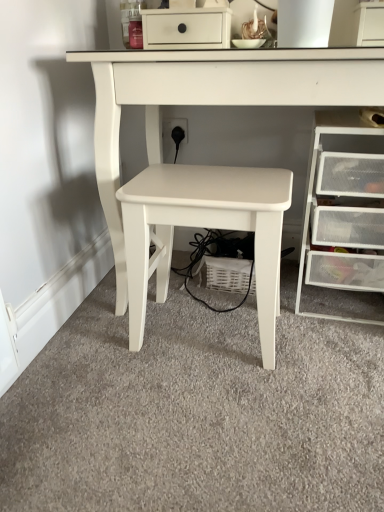
Where is `white matte table at center, the 1th table when ordered from right to left`? The height and width of the screenshot is (512, 384). white matte table at center, the 1th table when ordered from right to left is located at coordinates (208, 166).

Identify the location of white matte table at center, arranged as the 1th table when viewed from the left. (204, 227).

Locate an element on the screen. white matte table at center, the 1th table when ordered from right to left is located at coordinates (208, 166).

Can you see white matte table at center, arranged as the 1th table when viewed from the left, touching clear plastic drawers at right?

white matte table at center, arranged as the 1th table when viewed from the left, is not next to clear plastic drawers at right, and they're not touching.

Is white matte table at center, positioned as the second table in right-to-left order, further to camera compared to clear plastic drawers at right?

No, it is not.

I want to click on table that appears below the clear plastic drawers at right (from the image's perspective), so click(204, 227).

Consider the image. From the image's perspective, would you say clear plastic drawers at right is positioned over white matte table at center, arranged as the 1th table when viewed from the left?

Yes, from the image's perspective, clear plastic drawers at right is over white matte table at center, arranged as the 1th table when viewed from the left.

Where is `table located below the clear plastic drawers at right (from the image's perspective)`? The width and height of the screenshot is (384, 512). table located below the clear plastic drawers at right (from the image's perspective) is located at coordinates (204, 227).

From a real-world perspective, who is located lower, white matte table at center, positioned as the second table in right-to-left order, or white matte table at center, the 2th table positioned from the left?

white matte table at center, positioned as the second table in right-to-left order, is physically lower.

Considering the relative sizes of white matte table at center, positioned as the second table in right-to-left order, and white matte table at center, the 2th table positioned from the left, in the image provided, is white matte table at center, positioned as the second table in right-to-left order, taller than white matte table at center, the 2th table positioned from the left,?

In fact, white matte table at center, positioned as the second table in right-to-left order, may be shorter than white matte table at center, the 2th table positioned from the left.

Is white matte table at center, arranged as the 1th table when viewed from the left, inside or outside of white matte table at center, the 2th table positioned from the left?

white matte table at center, arranged as the 1th table when viewed from the left, exists entirely within white matte table at center, the 2th table positioned from the left.

From the image's perspective, is white matte table at center, positioned as the second table in right-to-left order, above or below white matte table at center, the 2th table positioned from the left?

→ white matte table at center, positioned as the second table in right-to-left order, is situated lower than white matte table at center, the 2th table positioned from the left, in the image.

Which of these two, white matte table at center, the 1th table when ordered from right to left, or white matte table at center, arranged as the 1th table when viewed from the left, is bigger?

white matte table at center, the 1th table when ordered from right to left, is bigger.

Considering the points (267, 332) and (139, 315), which point is behind, point (267, 332) or point (139, 315)?

Point (139, 315)

Is white matte table at center, the 2th table positioned from the left, in front of white matte table at center, arranged as the 1th table when viewed from the left?

Yes, white matte table at center, the 2th table positioned from the left, is closer to the camera.

Can you confirm if white matte table at center, the 1th table when ordered from right to left, is taller than clear plastic drawers at right?

Indeed, white matte table at center, the 1th table when ordered from right to left, has a greater height compared to clear plastic drawers at right.

Which object is closer to the camera, white matte table at center, the 1th table when ordered from right to left, or clear plastic drawers at right?

white matte table at center, the 1th table when ordered from right to left, is more forward.

In the scene shown: Looking at their sizes, would you say white matte table at center, the 1th table when ordered from right to left, is wider or thinner than clear plastic drawers at right?

white matte table at center, the 1th table when ordered from right to left, is wider than clear plastic drawers at right.

From the image's perspective, is clear plastic drawers at right located beneath white matte table at center, the 1th table when ordered from right to left?

Indeed, from the image's perspective, clear plastic drawers at right is shown beneath white matte table at center, the 1th table when ordered from right to left.

Considering the sizes of objects clear plastic drawers at right and white matte table at center, the 1th table when ordered from right to left, in the image provided, who is taller, clear plastic drawers at right or white matte table at center, the 1th table when ordered from right to left,?

white matte table at center, the 1th table when ordered from right to left.

Which of these two, clear plastic drawers at right or white matte table at center, the 1th table when ordered from right to left, is bigger?

white matte table at center, the 1th table when ordered from right to left, is bigger.

Does clear plastic drawers at right appear on the left side of white matte table at center, the 1th table when ordered from right to left?

No, clear plastic drawers at right is not to the left of white matte table at center, the 1th table when ordered from right to left.

Where is `chest of drawers behind the white matte table at center, arranged as the 1th table when viewed from the left`? This screenshot has height=512, width=384. chest of drawers behind the white matte table at center, arranged as the 1th table when viewed from the left is located at coordinates (344, 211).

At what (x,y) coordinates should I click in order to perform the action: click on the 2nd table counting from the left of the clear plastic drawers at right. Please return your answer as a coordinate pair (x, y). This screenshot has width=384, height=512. Looking at the image, I should click on (204, 227).

Considering their positions, is white matte table at center, the 2th table positioned from the left, positioned closer to clear plastic drawers at right than white matte table at center, positioned as the second table in right-to-left order?

Based on the image, white matte table at center, positioned as the second table in right-to-left order, appears to be nearer to clear plastic drawers at right.

From the image, which object appears to be nearer to clear plastic drawers at right, white matte table at center, arranged as the 1th table when viewed from the left, or white matte table at center, the 2th table positioned from the left?

white matte table at center, arranged as the 1th table when viewed from the left.

From the image, which object appears to be nearer to white matte table at center, arranged as the 1th table when viewed from the left, white matte table at center, the 1th table when ordered from right to left, or clear plastic drawers at right?

white matte table at center, the 1th table when ordered from right to left.

Based on their spatial positions, is clear plastic drawers at right or white matte table at center, the 1th table when ordered from right to left, further from white matte table at center, positioned as the second table in right-to-left order?

Among the two, clear plastic drawers at right is located further to white matte table at center, positioned as the second table in right-to-left order.

Which object lies nearer to the anchor point white matte table at center, the 2th table positioned from the left, clear plastic drawers at right or white matte table at center, positioned as the second table in right-to-left order?

Among the two, white matte table at center, positioned as the second table in right-to-left order, is located nearer to white matte table at center, the 2th table positioned from the left.

From the image, which object appears to be nearer to white matte table at center, the 2th table positioned from the left, white matte table at center, positioned as the second table in right-to-left order, or clear plastic drawers at right?

white matte table at center, positioned as the second table in right-to-left order.

This screenshot has width=384, height=512. Identify the location of table situated between white matte table at center, arranged as the 1th table when viewed from the left, and clear plastic drawers at right from left to right. (208, 166).